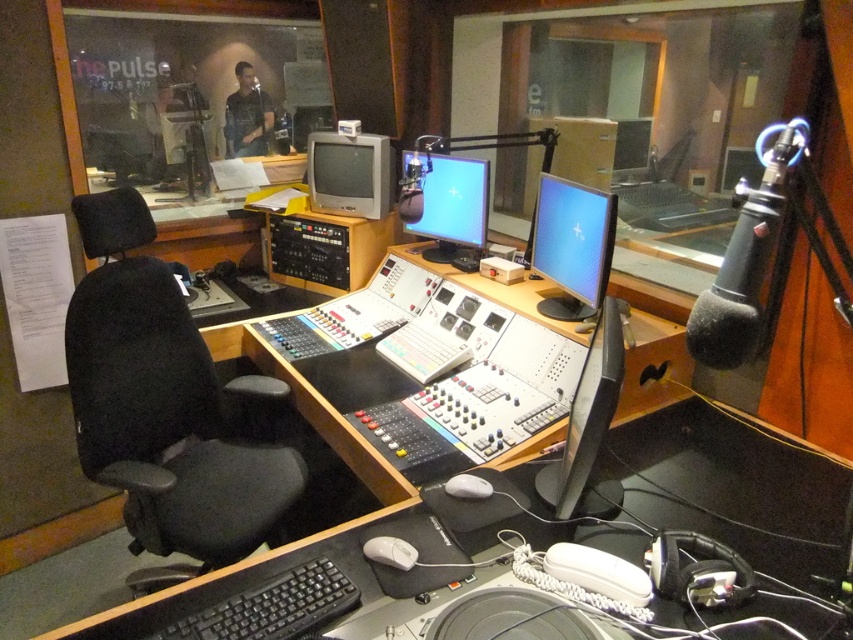
Question: Which point is closer to the camera?

Choices:
 (A) (474, 497)
 (B) (334, 582)
 (C) (395, 538)

Answer: (B)

Question: Can you confirm if matte black monitor at center is positioned below white plastic mouse at lower center?

Choices:
 (A) no
 (B) yes

Answer: (A)

Question: Among these points, which one is farthest from the camera?

Choices:
 (A) [x=363, y=218]
 (B) [x=479, y=486]
 (C) [x=563, y=230]
 (D) [x=343, y=586]

Answer: (A)

Question: Estimate the real-world distances between objects in this image. Which object is closer to the white plastic mouse at lower center?

Choices:
 (A) black matte monitor at center
 (B) white matte mouse at center
 (C) matte gray crt monitor at center
 (D) black fabric swivel chair at left

Answer: (B)

Question: Can you confirm if black plastic keyboard at lower left is wider than black matte monitor at center?

Choices:
 (A) no
 (B) yes

Answer: (B)

Question: Can you confirm if black fabric swivel chair at left is thinner than matte gray crt monitor at center?

Choices:
 (A) no
 (B) yes

Answer: (A)